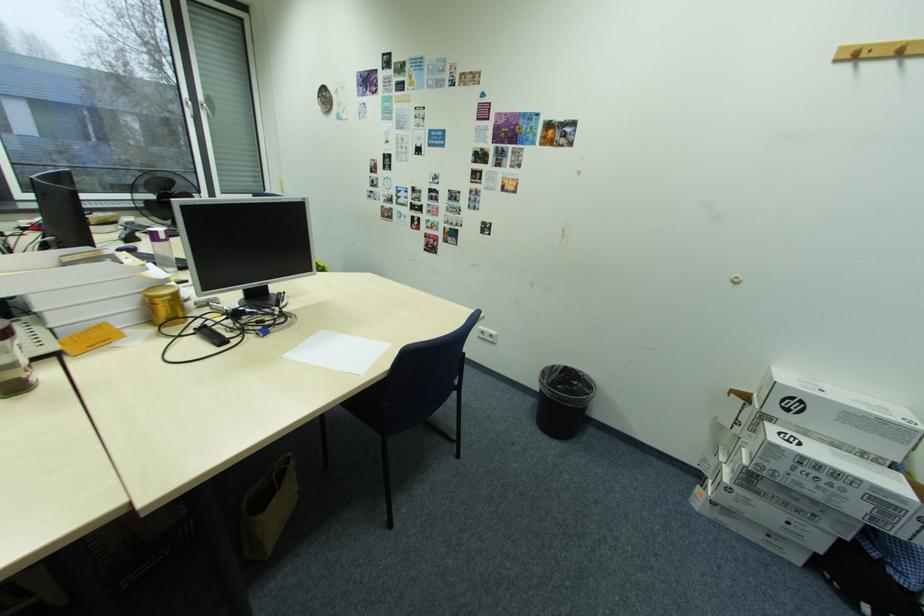
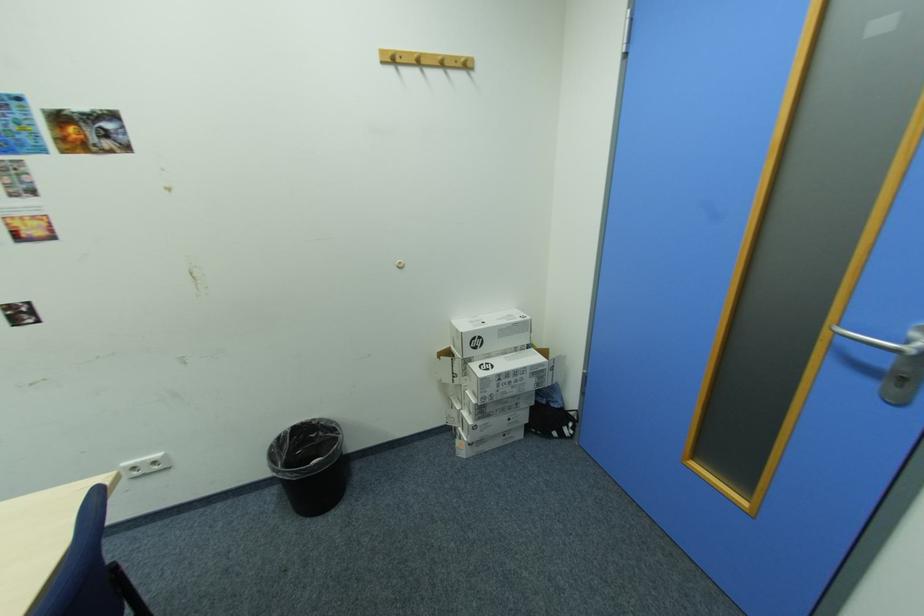
The point at [584,384] is marked in the first image. Where is the corresponding point in the second image?

(322, 436)